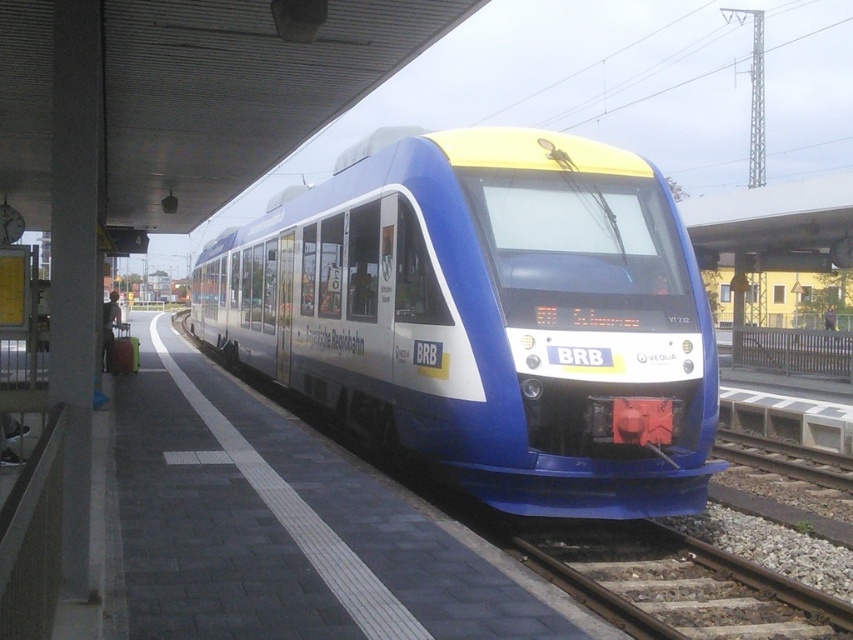
Between blue glossy train at center and matte blue train at center, which one has more height?

Standing taller between the two is blue glossy train at center.

Which is more to the left, blue glossy train at center or matte blue train at center?

matte blue train at center is more to the left.

Where is `blue glossy train at center`? This screenshot has height=640, width=853. blue glossy train at center is located at coordinates (486, 316).

Is blue glossy train at center thinner than brown wooden train track at lower right?

No, blue glossy train at center is not thinner than brown wooden train track at lower right.

Who is more distant from viewer, (596, 477) or (671, 616)?

Positioned behind is point (596, 477).

Image resolution: width=853 pixels, height=640 pixels. I want to click on blue glossy train at center, so click(x=486, y=316).

Find the location of a particular element. brown wooden train track at lower right is located at coordinates (677, 582).

Between point (752, 602) and point (102, 337), which one is positioned behind?

Point (102, 337)

From the picture: Who is more distant from viewer, [802,593] or [111,316]?

Positioned behind is point [111,316].

I want to click on brown wooden train track at lower right, so click(x=677, y=582).